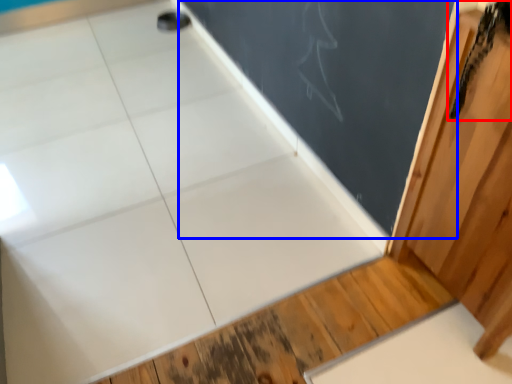
Question: Which point is further to the camera, animal (highlighted by a red box) or bulletin board (highlighted by a blue box)?

Choices:
 (A) animal
 (B) bulletin board

Answer: (B)